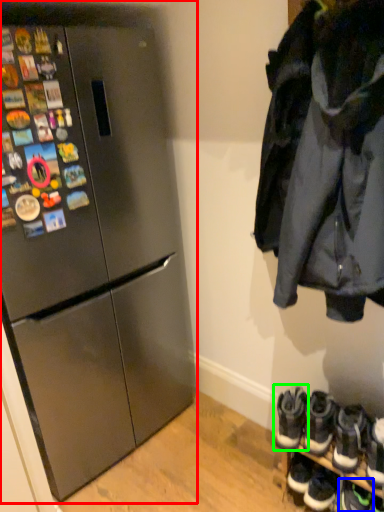
Question: Which is farther away from refrigerator (highlighted by a red box)? footwear (highlighted by a blue box) or footwear (highlighted by a green box)?

Choices:
 (A) footwear
 (B) footwear

Answer: (A)